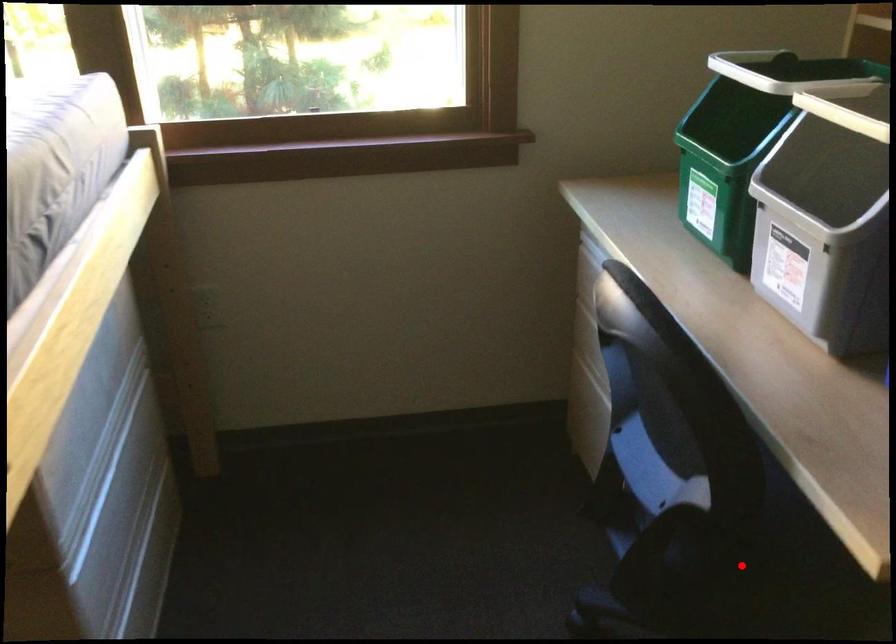
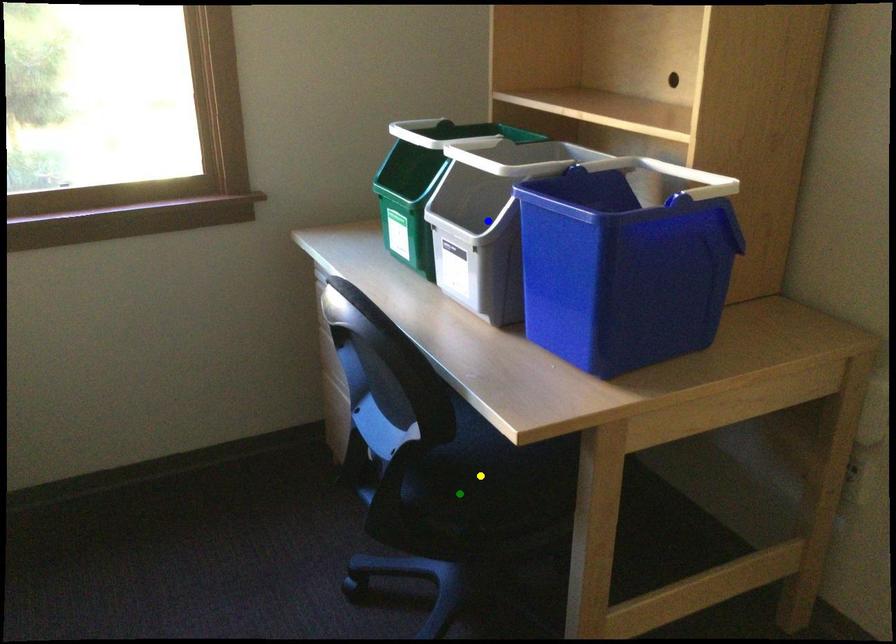
Question: I am providing you with two images of the same scene from different viewpoints. A red point is marked on the first image. You are given multiple points on the second image. Which mark in image 2 goes with the point in image 1?

Choices:
 (A) green point
 (B) yellow point
 (C) blue point

Answer: (A)